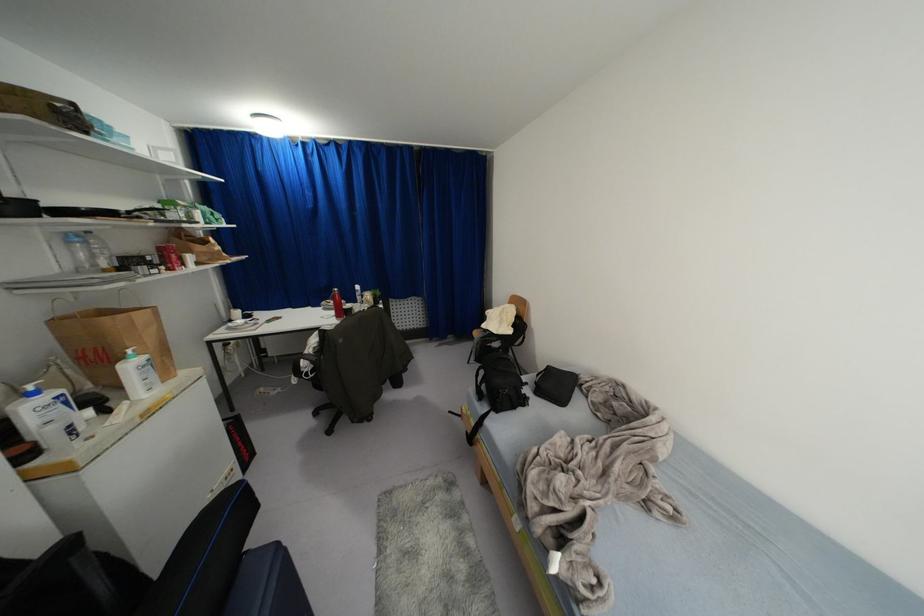
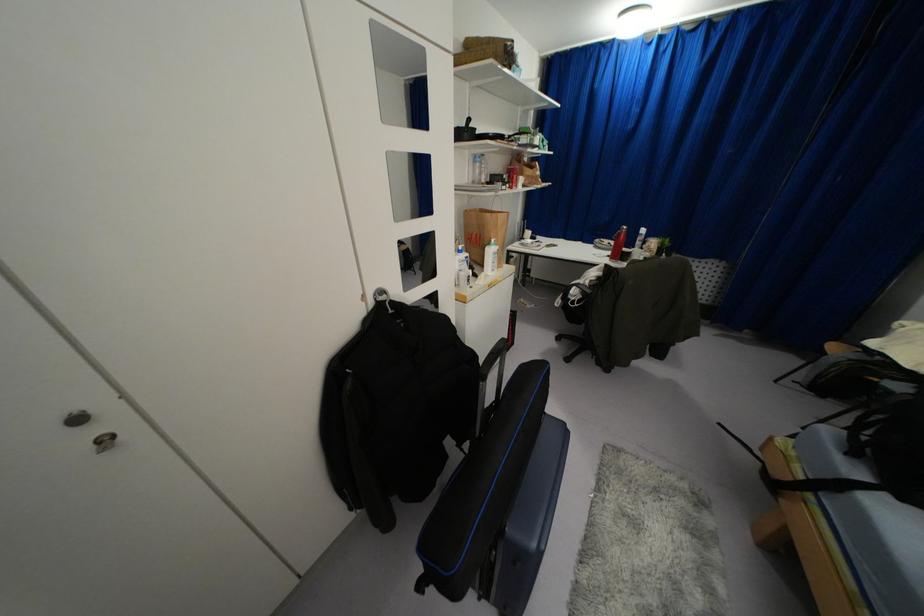
Find the pixel in the second image that matches point (68, 241) in the first image.

(475, 161)